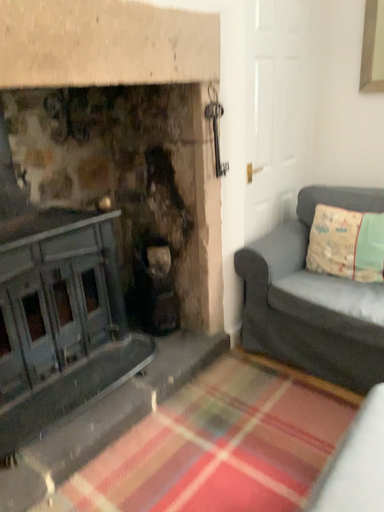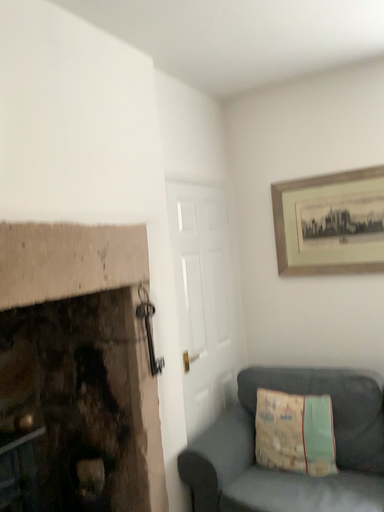
Question: How did the camera likely rotate when shooting the video?

Choices:
 (A) rotated left
 (B) rotated right

Answer: (B)